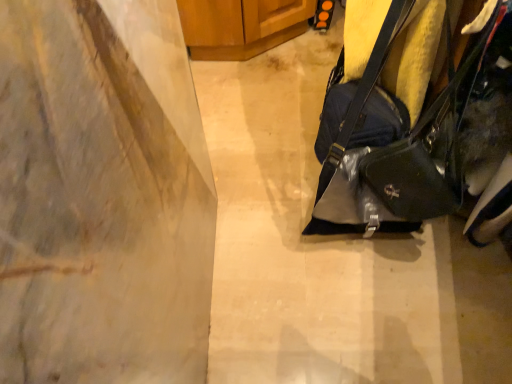
Question: From the image's perspective, is glossy black handbag at right above or below matte gray concrete at center?

Choices:
 (A) below
 (B) above

Answer: (B)

Question: Is glossy black handbag at right in front of or behind matte gray concrete at center in the image?

Choices:
 (A) front
 (B) behind

Answer: (A)

Question: Which is nearer to the matte gray concrete at center?

Choices:
 (A) glossy black handbag at right
 (B) wooden cabinet at upper center

Answer: (A)

Question: Which is nearer to the glossy black handbag at right?

Choices:
 (A) wooden cabinet at upper center
 (B) matte gray concrete at center

Answer: (B)